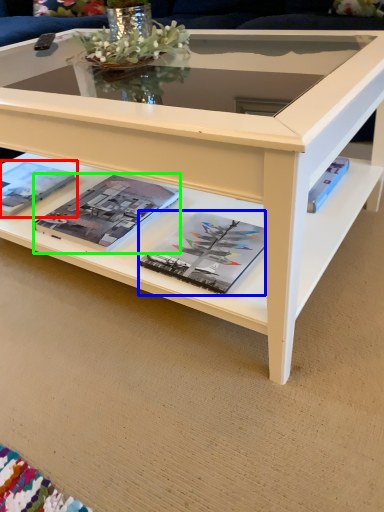
Question: Which is farther away from magazine (highlighted by a red box)? magazine (highlighted by a blue box) or magazine (highlighted by a green box)?

Choices:
 (A) magazine
 (B) magazine

Answer: (A)